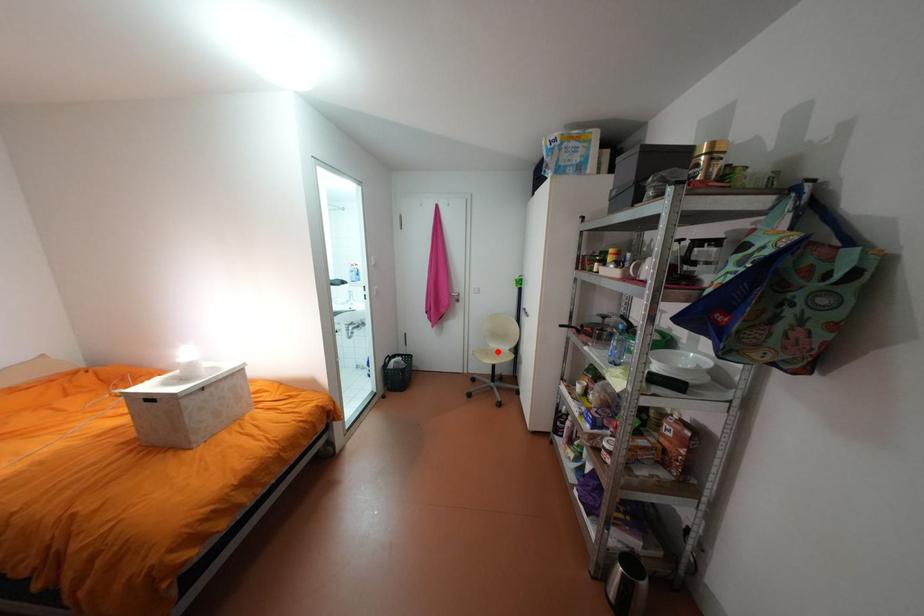
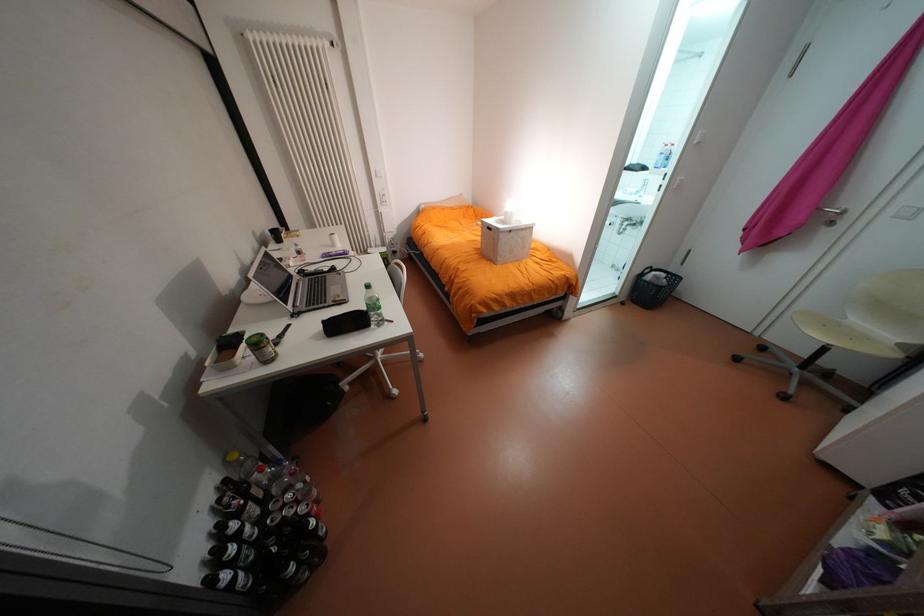
In the second image, find the point that corresponds to the highlighted location in the first image.

(840, 323)